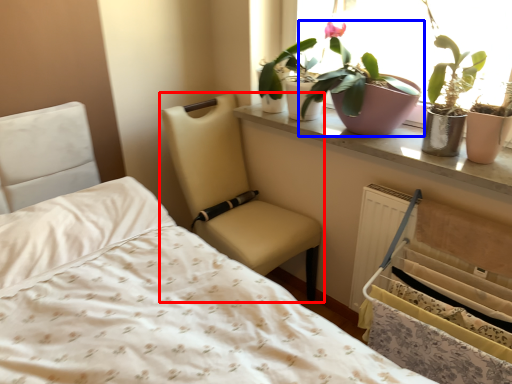
Question: Among these objects, which one is nearest to the camera, chair (highlighted by a red box) or houseplant (highlighted by a blue box)?

Choices:
 (A) chair
 (B) houseplant

Answer: (B)